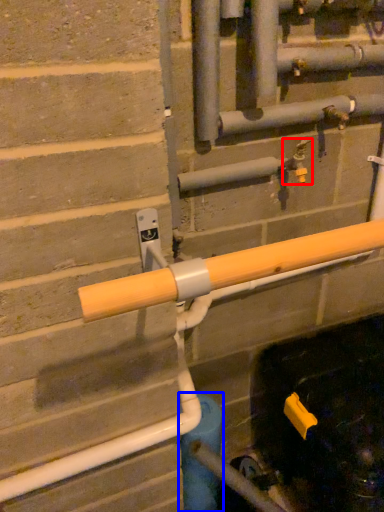
Question: Which object appears closest to the camera in this image, plumbing fixture (highlighted by a red box) or water pipe (highlighted by a blue box)?

Choices:
 (A) plumbing fixture
 (B) water pipe

Answer: (A)